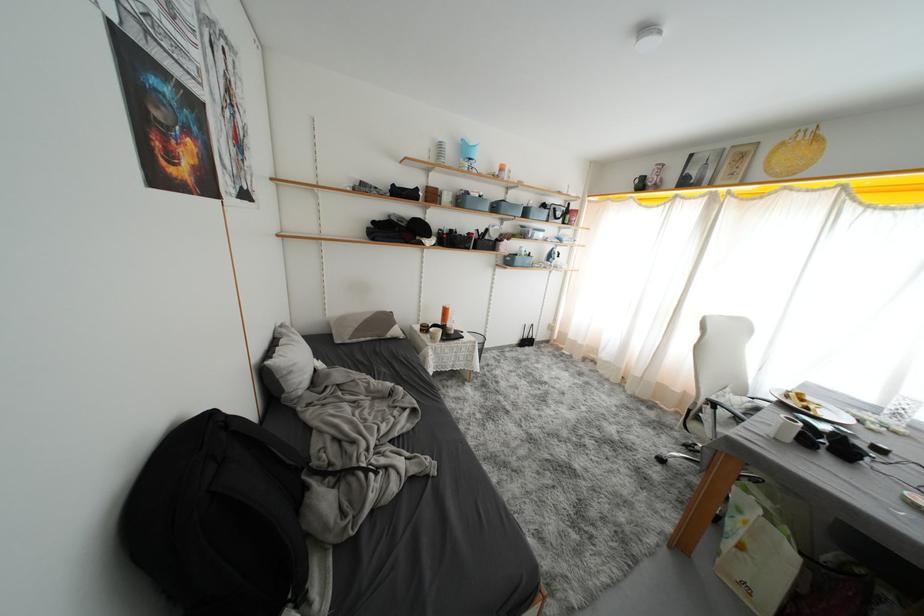
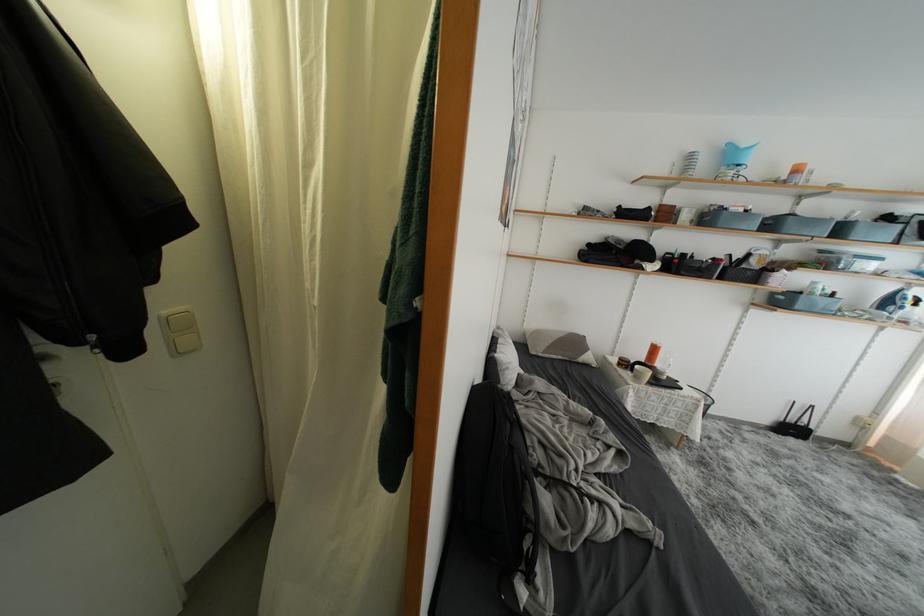
The point at (x=502, y=212) is marked in the first image. Where is the corresponding point in the second image?

(777, 229)